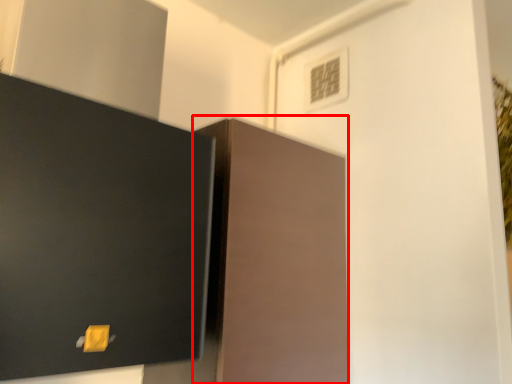
Question: From the image's perspective, where is cabinetry (annotated by the red box) located in relation to light switch in the image?

Choices:
 (A) below
 (B) above

Answer: (A)